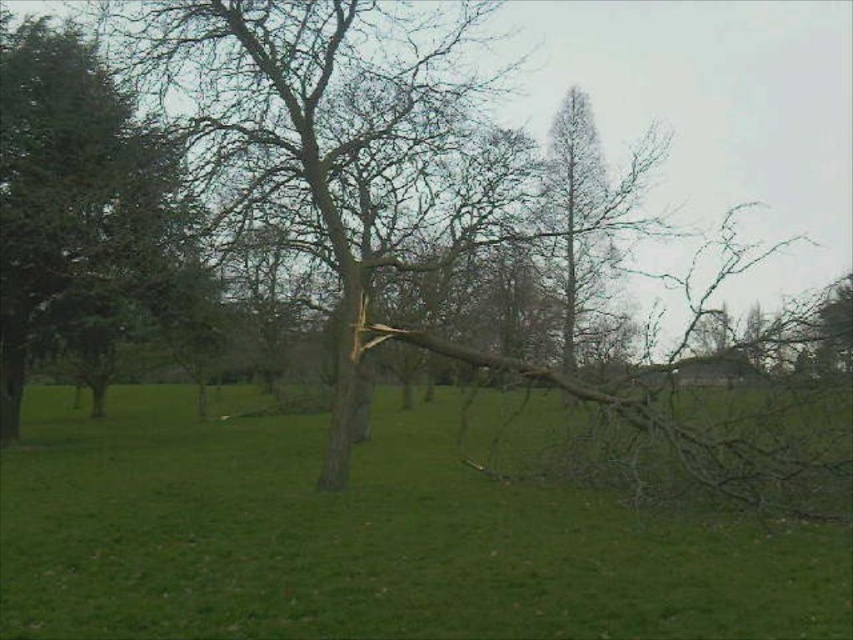
You are standing in the middle of the field and want to place a small garden statue between the brown wood log at center and the green leafy tree at left. Which object should you position the statue closer to if you want it to be closer to the shorter object?

The brown wood log at center has a lesser height compared to the green leafy tree at left, so you should position the statue closer to the brown wood log at center since it is the shorter object.

In the scene, there is a point marked at coordinates (364, 538). What object is located at this point?

The point at coordinates (364, 538) indicates the brown wood log at center.